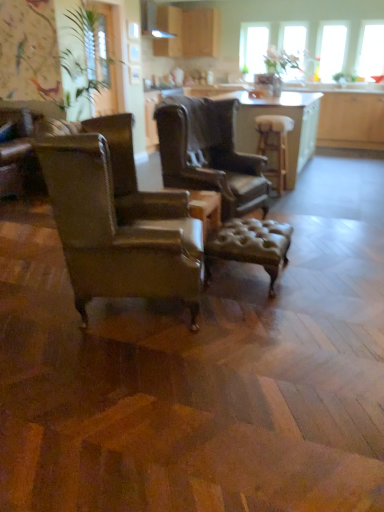
Question: Is clear glass window at upper center, the 1th window screen when ordered from left to right, located outside leather armchair at center, the 2th chair when ordered from front to back?

Choices:
 (A) yes
 (B) no

Answer: (A)

Question: Is clear glass window at upper center, which is the fourth window screen from right to left, positioned with its back to leather armchair at center, the 2th chair when ordered from front to back?

Choices:
 (A) no
 (B) yes

Answer: (A)

Question: Considering the relative positions of clear glass window at upper center, the 1th window screen when ordered from left to right, and leather armchair at center, the 1th chair in the back-to-front sequence, in the image provided, is clear glass window at upper center, the 1th window screen when ordered from left to right, behind leather armchair at center, the 1th chair in the back-to-front sequence,?

Choices:
 (A) no
 (B) yes

Answer: (B)

Question: Considering the relative sizes of clear glass window at upper center, the 1th window screen when ordered from left to right, and leather armchair at center, the 2th chair when ordered from front to back, in the image provided, is clear glass window at upper center, the 1th window screen when ordered from left to right, bigger than leather armchair at center, the 2th chair when ordered from front to back,?

Choices:
 (A) no
 (B) yes

Answer: (A)

Question: From the image's perspective, is clear glass window at upper center, the 1th window screen when ordered from left to right, over leather armchair at center, the 1th chair in the back-to-front sequence?

Choices:
 (A) no
 (B) yes

Answer: (B)

Question: Does clear glass window at upper center, the 1th window screen when ordered from left to right, have a lesser width compared to leather armchair at center, the 1th chair in the back-to-front sequence?

Choices:
 (A) yes
 (B) no

Answer: (A)

Question: Is green leafy plant at upper left touching clear glass window at upper center, the 1th window screen when ordered from left to right?

Choices:
 (A) yes
 (B) no

Answer: (B)

Question: From a real-world perspective, is green leafy plant at upper left positioned under clear glass window at upper center, which is the fourth window screen from right to left, based on gravity?

Choices:
 (A) no
 (B) yes

Answer: (B)

Question: Considering the relative positions of green leafy plant at upper left and clear glass window at upper center, the 1th window screen when ordered from left to right, in the image provided, is green leafy plant at upper left behind clear glass window at upper center, the 1th window screen when ordered from left to right,?

Choices:
 (A) yes
 (B) no

Answer: (B)

Question: Is clear glass window at upper center, the 1th window screen when ordered from left to right, a part of green leafy plant at upper left?

Choices:
 (A) no
 (B) yes

Answer: (A)

Question: Does green leafy plant at upper left have a greater height compared to clear glass window at upper center, the 1th window screen when ordered from left to right?

Choices:
 (A) yes
 (B) no

Answer: (A)

Question: Would you say green leafy plant at upper left is outside clear glass window at upper center, the 1th window screen when ordered from left to right?

Choices:
 (A) no
 (B) yes

Answer: (B)

Question: Is green leafy plant at upper left positioned before leather armchair at left, acting as the first chair starting from the front?

Choices:
 (A) yes
 (B) no

Answer: (B)